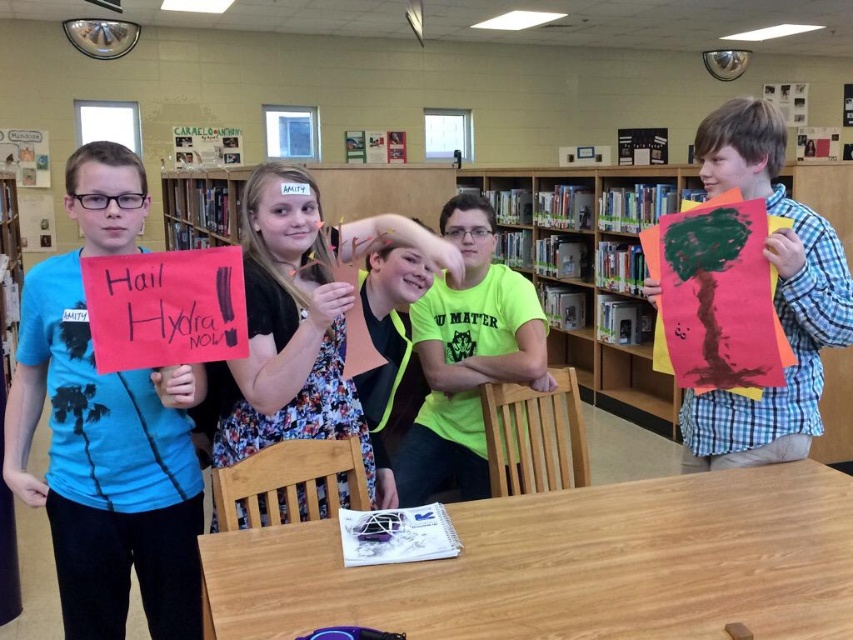
Question: Among these points, which one is nearest to the camera?

Choices:
 (A) click(808, 356)
 (B) click(460, 477)

Answer: (A)

Question: Can you confirm if floral dress at center is thinner than neon green t-shirt at center?

Choices:
 (A) yes
 (B) no

Answer: (A)

Question: Can you confirm if matte blue t-shirt at left is positioned above plaid fabric shirt at right?

Choices:
 (A) no
 (B) yes

Answer: (A)

Question: Estimate the real-world distances between objects in this image. Which object is farther from the wooden bookshelf at center?

Choices:
 (A) neon green t-shirt at center
 (B) plaid fabric shirt at right
 (C) floral dress at center
 (D) matte blue t-shirt at left

Answer: (B)

Question: Is wooden bookshelf at center behind neon green t-shirt at center?

Choices:
 (A) no
 (B) yes

Answer: (B)

Question: Which of the following is the closest to the observer?

Choices:
 (A) (239, 192)
 (B) (456, 490)
 (C) (184, 404)

Answer: (C)